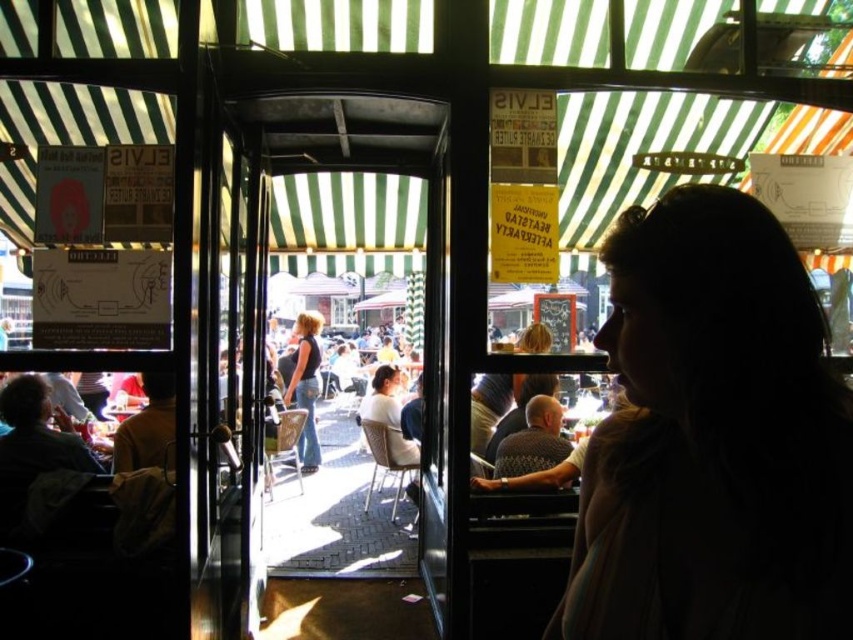
You are standing in the outdoor area of the cafe and want to approach the person inside the cafe through the glass doors. The glass doors are 3 feet wide. Can you walk through the doors to reach the silhouette hair at right?

The silhouette hair at right and the viewer are 3.61 feet apart. Since the glass doors are 3 feet wide, you can walk through the doors to reach the silhouette hair at right as the distance between you and the hair is greater than the door width.

You are a photographer trying to capture the silhouette of the person in the foreground. Which part of the silhouette, the silhouette hair at right or the denim jeans at center, will appear larger in the photo?

The silhouette hair at right is closer to the viewer than the denim jeans at center, so it will appear larger in the photo.

You are a delivery person standing outside the outdoor cafe. You need to deliver a package to the person inside the cafe whose silhouette is visible. The package must be placed exactly at the location of the silhouette hair at right. However, you can only throw the package through the glass doors to the denim jeans at center. Will the package land near the intended location?

The silhouette hair at right and denim jeans at center are 6.38 meters apart from each other. Since the package is thrown to the denim jeans at center, it will not reach the silhouette hair at right which is 6.38 meters away. The package will land near the denim jeans at center instead.